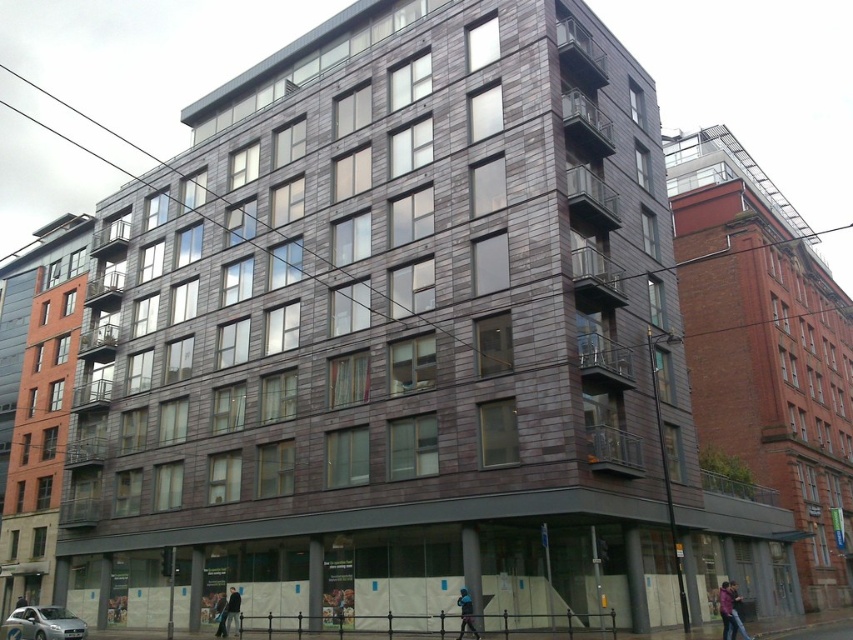
This screenshot has width=853, height=640. Describe the element at coordinates (726, 611) in the screenshot. I see `leather jacket at lower right` at that location.

Who is lower down, leather jacket at lower right or dark gray fabric jacket at center?

dark gray fabric jacket at center is lower down.

Where is `leather jacket at lower right`? The height and width of the screenshot is (640, 853). leather jacket at lower right is located at coordinates (726, 611).

Between blue fabric jacket at lower center and dark blue jacket at lower right, which one is positioned higher?

blue fabric jacket at lower center is above.

Is blue fabric jacket at lower center to the right of dark blue jacket at lower right from the viewer's perspective?

No, blue fabric jacket at lower center is not to the right of dark blue jacket at lower right.

Which is in front, point (459, 595) or point (738, 612)?

Positioned in front is point (738, 612).

You are a GUI agent. You are given a task and a screenshot of the screen. Output one action in this format:
    pyautogui.click(x=<x>, y=<y>)
    Task: Click on the blue fabric jacket at lower center
    This screenshot has height=640, width=853.
    Given the screenshot: What is the action you would take?
    pyautogui.click(x=465, y=612)

Can you confirm if blue fabric jacket at lower center is wider than dark blue jacket at lower center?

Yes.

Which is more to the right, blue fabric jacket at lower center or dark blue jacket at lower center?

blue fabric jacket at lower center

Image resolution: width=853 pixels, height=640 pixels. I want to click on blue fabric jacket at lower center, so click(465, 612).